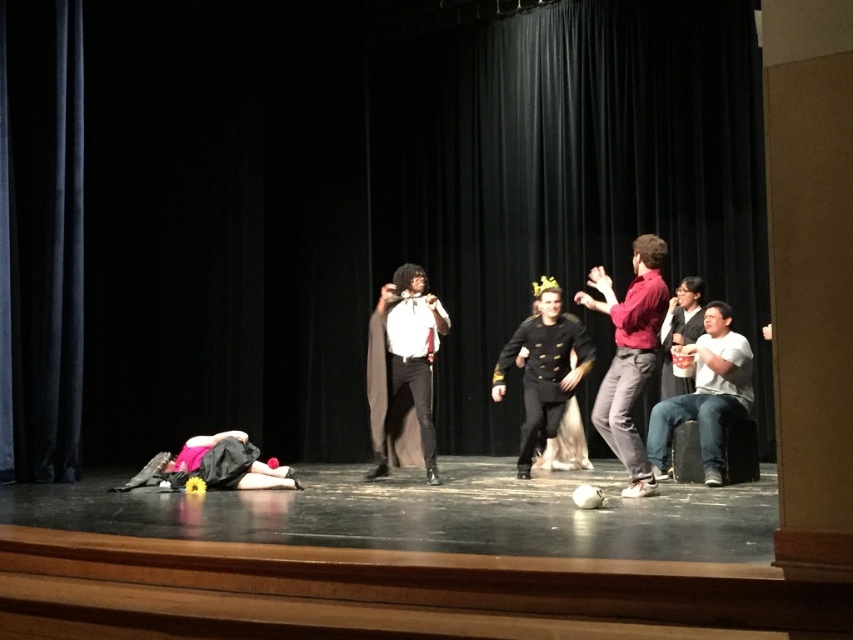
Question: Which point appears closest to the camera in this image?

Choices:
 (A) (387, 342)
 (B) (598, 388)

Answer: (B)

Question: Can you confirm if matte red shirt at center is smaller than jeans at right?

Choices:
 (A) no
 (B) yes

Answer: (B)

Question: Which point is farther to the camera?

Choices:
 (A) (705, 385)
 (B) (737, 224)
 (C) (537, 378)
 (D) (665, 305)

Answer: (B)

Question: Which point is closer to the camera?

Choices:
 (A) black velvet curtain at center
 (B) matte black cape at center
 (C) black matte uniform at center

Answer: (B)

Question: Does matte black cape at center appear over black matte uniform at center?

Choices:
 (A) yes
 (B) no

Answer: (A)

Question: Does jeans at right have a larger size compared to black matte uniform at center?

Choices:
 (A) no
 (B) yes

Answer: (A)